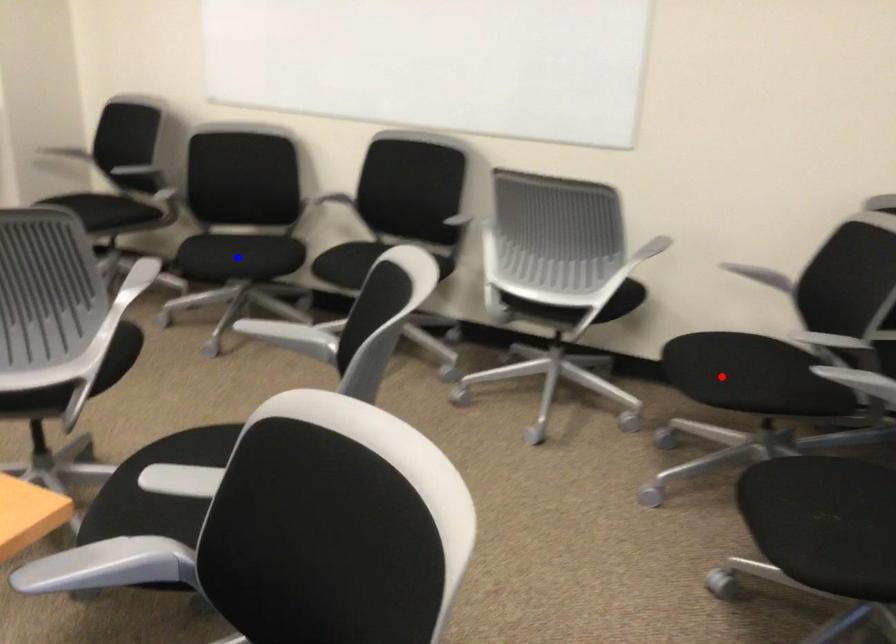
Question: Two points are marked on the image. Which point is closer to the camera?

Choices:
 (A) Blue point is closer.
 (B) Red point is closer.

Answer: (B)